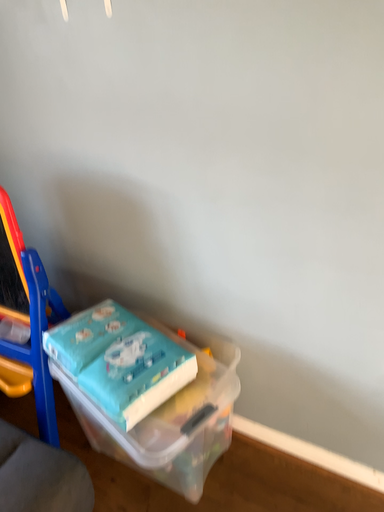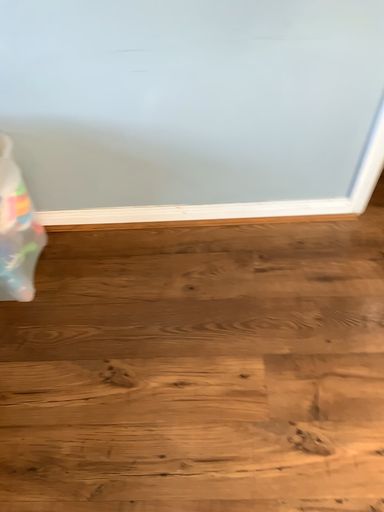
Question: How did the camera likely rotate when shooting the video?

Choices:
 (A) rotated left
 (B) rotated right

Answer: (B)